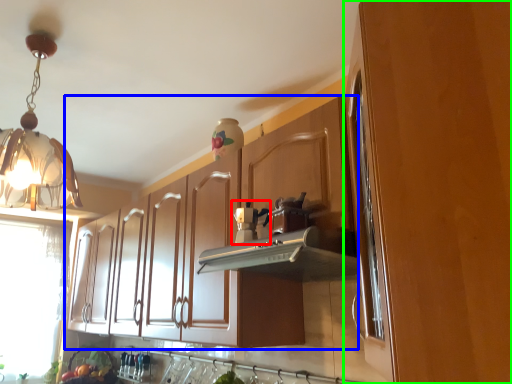
Question: Which is farther away from coffee machine (highlighted by a red box)? cabinetry (highlighted by a blue box) or cabinetry (highlighted by a green box)?

Choices:
 (A) cabinetry
 (B) cabinetry

Answer: (B)